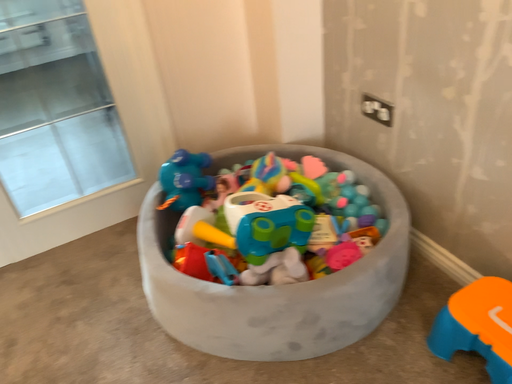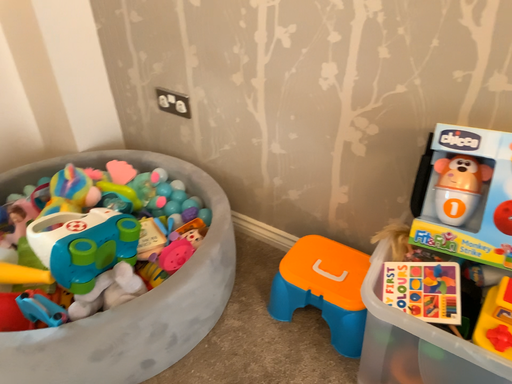
Question: How did the camera likely rotate when shooting the video?

Choices:
 (A) rotated right
 (B) rotated left

Answer: (A)